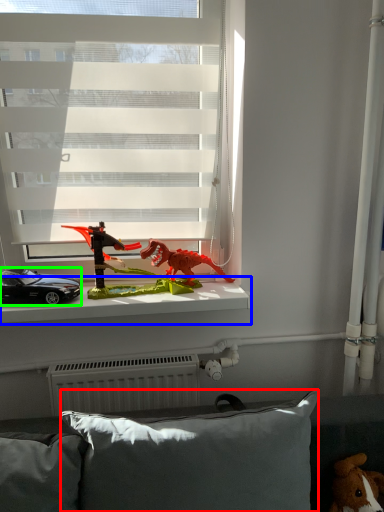
Question: Which object is positioned farthest from pillow (highlighted by a red box)? Select from window sill (highlighted by a blue box) and car (highlighted by a green box).

Choices:
 (A) window sill
 (B) car

Answer: (B)